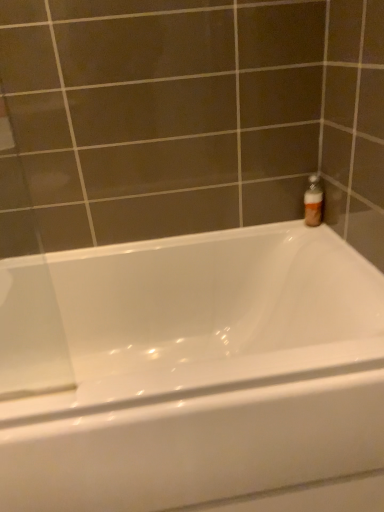
I want to click on free space to the left of translucent plastic bottle at upper right, so click(277, 231).